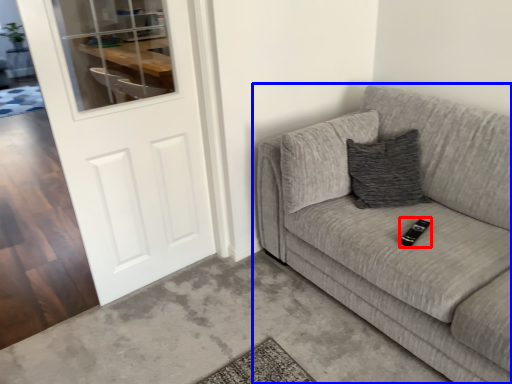
Question: Among these objects, which one is farthest to the camera, remote (highlighted by a red box) or studio couch (highlighted by a blue box)?

Choices:
 (A) remote
 (B) studio couch

Answer: (A)